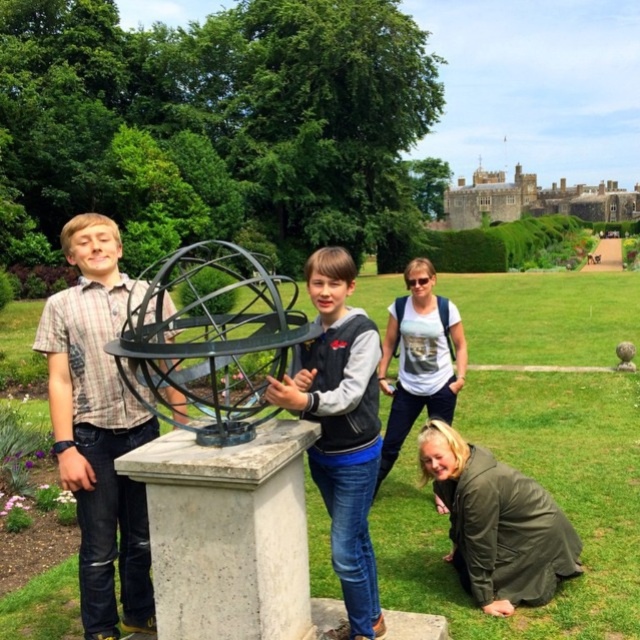
Which of these two, striped cotton shirt at left or white cotton t-shirt at center, stands taller?

With more height is striped cotton shirt at left.

Who is lower down, striped cotton shirt at left or white cotton t-shirt at center?

Positioned lower is white cotton t-shirt at center.

Measure the distance between point (x=138, y=586) and camera.

A distance of 169.39 feet exists between point (x=138, y=586) and camera.

You are a GUI agent. You are given a task and a screenshot of the screen. Output one action in this format:
    pyautogui.click(x=<x>, y=<y>)
    Task: Click on the striped cotton shirt at left
    
    Given the screenshot: What is the action you would take?
    pyautogui.click(x=97, y=428)

Is green matte jacket at lower right thinner than white cotton t-shirt at center?

No, green matte jacket at lower right is not thinner than white cotton t-shirt at center.

Can you confirm if green matte jacket at lower right is positioned to the right of white cotton t-shirt at center?

Correct, you'll find green matte jacket at lower right to the right of white cotton t-shirt at center.

What are the coordinates of `green matte jacket at lower right` in the screenshot? It's located at (497, 524).

The height and width of the screenshot is (640, 640). What are the coordinates of `green matte jacket at lower right` in the screenshot? It's located at (497, 524).

Does polished metal sculpture at center have a greater width compared to black metal sphere at center?

Yes, polished metal sculpture at center is wider than black metal sphere at center.

Based on the photo, between polished metal sculpture at center and black metal sphere at center, which one has more height?

With more height is polished metal sculpture at center.

Does point (467, 316) lie behind point (216, 429)?

Yes, point (467, 316) is behind point (216, 429).

I want to click on polished metal sculpture at center, so click(x=548, y=490).